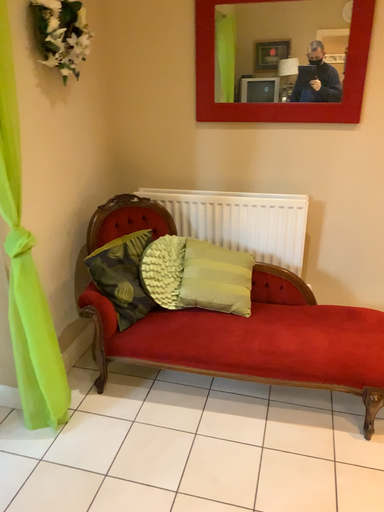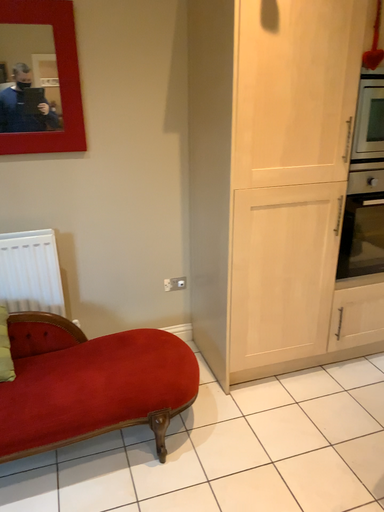
Question: How did the camera likely rotate when shooting the video?

Choices:
 (A) rotated downward
 (B) rotated upward

Answer: (B)